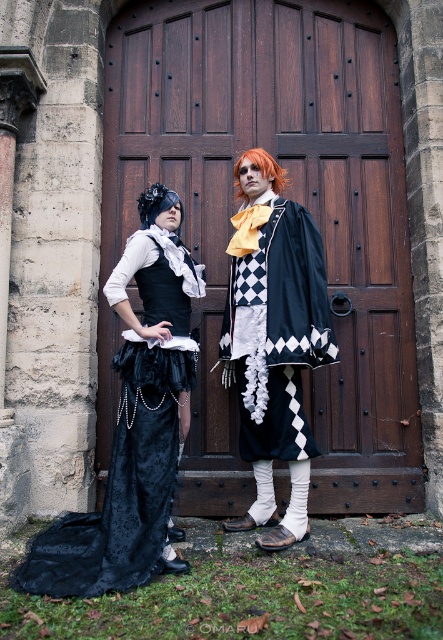
Question: Is brown wooden door at center to the right of black velvet coat at center from the viewer's perspective?

Choices:
 (A) no
 (B) yes

Answer: (A)

Question: Which object appears closest to the camera in this image?

Choices:
 (A) black velvet dress at left
 (B) black velvet coat at center
 (C) brown wooden door at center
 (D) orange synthetic wig at center

Answer: (A)

Question: Is brown wooden door at center smaller than black velvet coat at center?

Choices:
 (A) no
 (B) yes

Answer: (A)

Question: Is black velvet dress at left wider than black velvet coat at center?

Choices:
 (A) yes
 (B) no

Answer: (A)

Question: Among these points, which one is nearest to the camera?

Choices:
 (A) (264, 154)
 (B) (275, 332)

Answer: (B)

Question: Which point is closer to the camera?

Choices:
 (A) (412, 477)
 (B) (115, 524)
 (C) (300, 352)

Answer: (B)